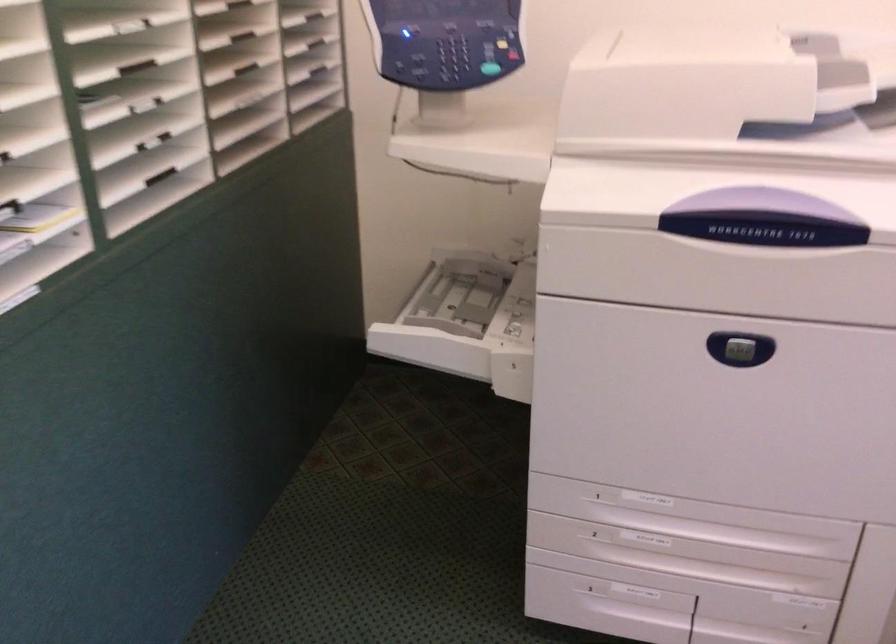
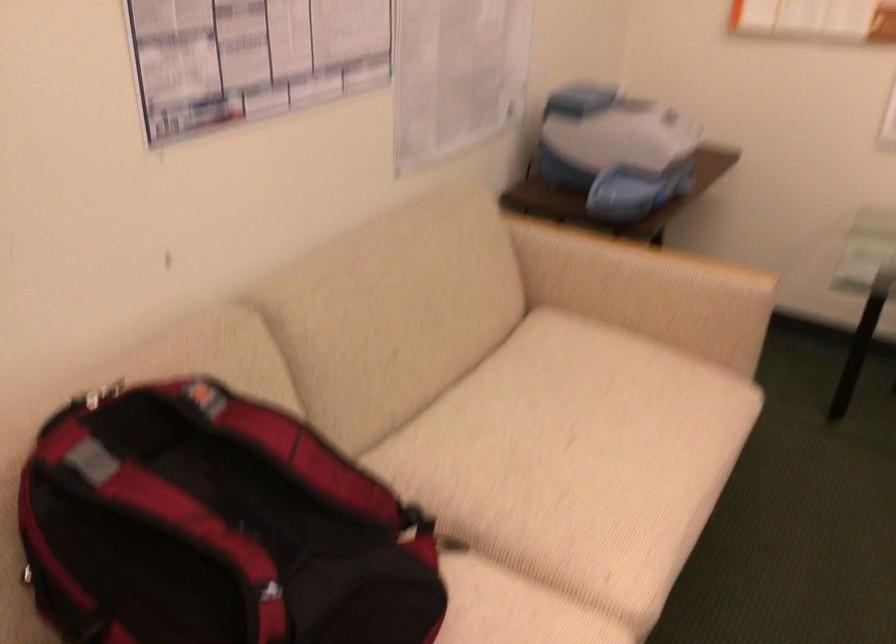
Question: Which direction would the cameraman need to move to produce the second image? Reply with the corresponding letter.

Choices:
 (A) Left
 (B) Right
 (C) Forward
 (D) Backward

Answer: (A)